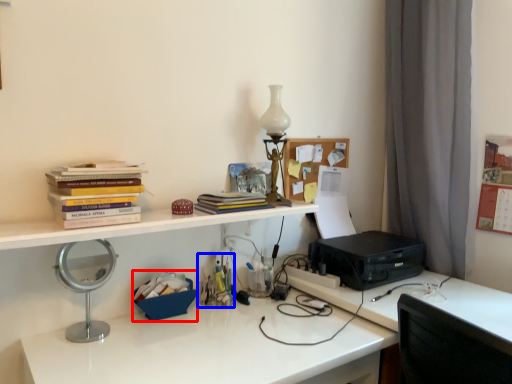
Question: Which object appears farthest to the camera in this image, stationery (highlighted by a red box) or stationery (highlighted by a blue box)?

Choices:
 (A) stationery
 (B) stationery

Answer: (B)